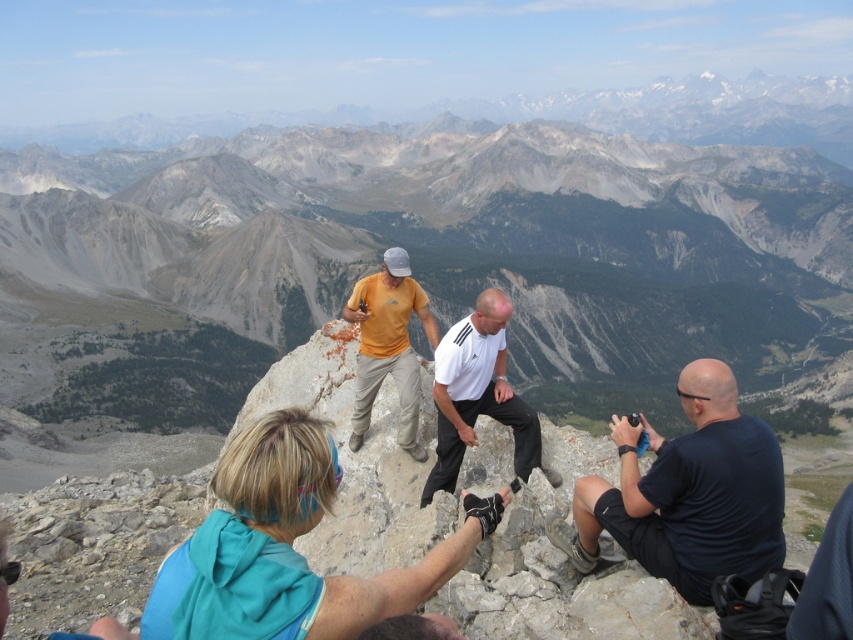
Question: Can you confirm if blue fabric at center is positioned below yellow matte shirt at center?

Choices:
 (A) no
 (B) yes

Answer: (B)

Question: Can you confirm if dark blue shirt at right is positioned above white matte shirt at center?

Choices:
 (A) no
 (B) yes

Answer: (A)

Question: Which is nearer to the dark blue shirt at right?

Choices:
 (A) yellow matte shirt at center
 (B) blue fabric at center
 (C) white matte shirt at center

Answer: (C)

Question: Which point is closer to the camera?

Choices:
 (A) blue fabric at center
 (B) dark blue shirt at right

Answer: (A)

Question: Which object is closer to the camera taking this photo?

Choices:
 (A) dark blue shirt at right
 (B) yellow matte shirt at center
 (C) blue fabric at center

Answer: (C)

Question: Observing the image, what is the correct spatial positioning of dark blue shirt at right in reference to yellow matte shirt at center?

Choices:
 (A) above
 (B) below

Answer: (B)